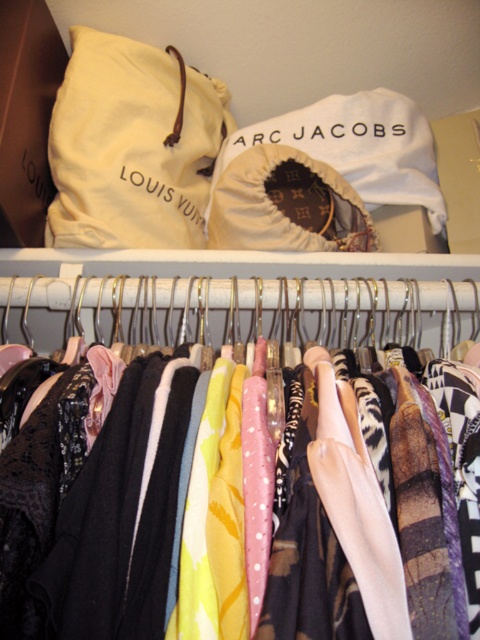
You are standing in front of the closet and want to reach a point that is closer to you. Which point should you aim for, point (242, 387) or point (90, 129)?

You should aim for point (242, 387) because it is closer to the camera than point (90, 129).

You are a fashion designer organizing a closet. You need to place a new accessory between the silky fabric dresses at center and the beige fabric bag at upper left. Considering their sizes, which object should the accessory be closer to?

The silky fabric dresses at center has a larger size compared to the beige fabric bag at upper left, so the accessory should be placed closer to the beige fabric bag at upper left to maintain balance in the arrangement.